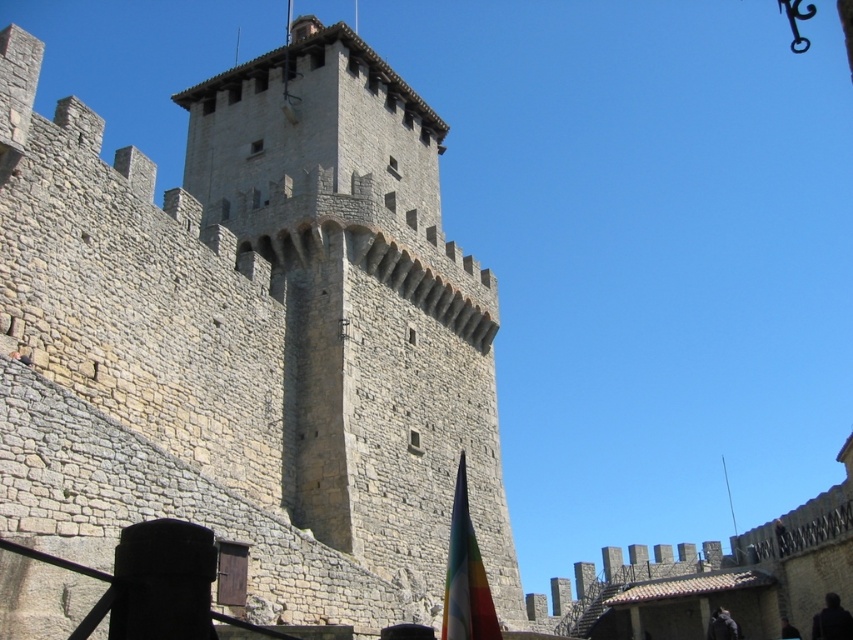
Consider the image. You are a medieval knight standing at the base of the fortress wall. You see the stone tower at center and the multicolored fabric flag at lower center. Which object is taller?

The stone tower at center is much taller than the multicolored fabric flag at lower center.

You are a medieval archer positioned at the base of the fortress. Your target is a hostile figure approaching the stone tower at center. If your arrow can travel 25 meters before losing its force, will you be able to hit the target from your current position?

The stone tower at center is 24.50 meters away from the viewer. Since your arrow can travel 25 meters, you are within range and can hit the target.

You are a medieval architect examining the fortress layout. The fortress must have a main gate positioned at coordinates point 0.5, 0.5. Is the stone tower at center located north of the main gate?

The stone tower at center is located at point (251, 336), which is north of the main gate at point (426, 320). Therefore, the stone tower at center is north of the main gate.